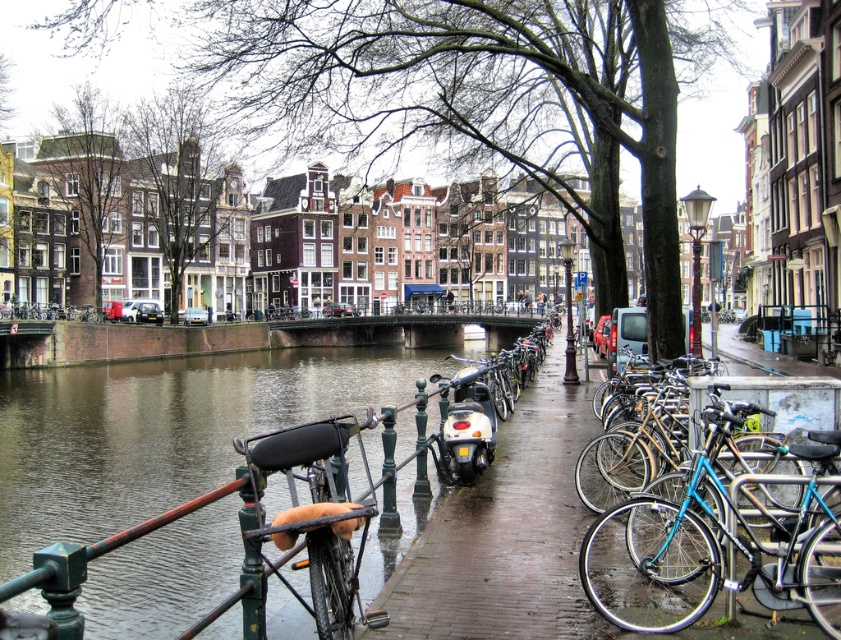
You are a tourist standing on the brick pavement at center and want to reach the blue metallic bicycle at right. Which direction should you move to get there?

The brick pavement at center is to the right of the blue metallic bicycle at right. To reach the bicycle, you should move to the left.

You are a delivery person with a cart that is 5 meters wide. You need to move from the brick pavement at center to the blue metallic bicycle at right. Is there enough space for your cart to pass through the area between them?

The distance between the brick pavement at center and the blue metallic bicycle at right is 5.01 meters, which is just slightly wider than the cart. Therefore, the cart can pass through the space between them as the distance is sufficient.